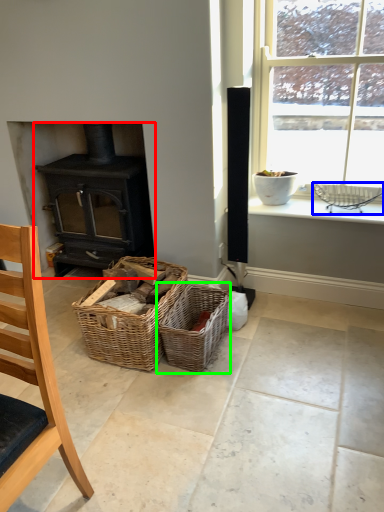
Question: Which is farther away from wood burning stove (highlighted by a red box)? basket (highlighted by a blue box) or picnic basket (highlighted by a green box)?

Choices:
 (A) basket
 (B) picnic basket

Answer: (A)